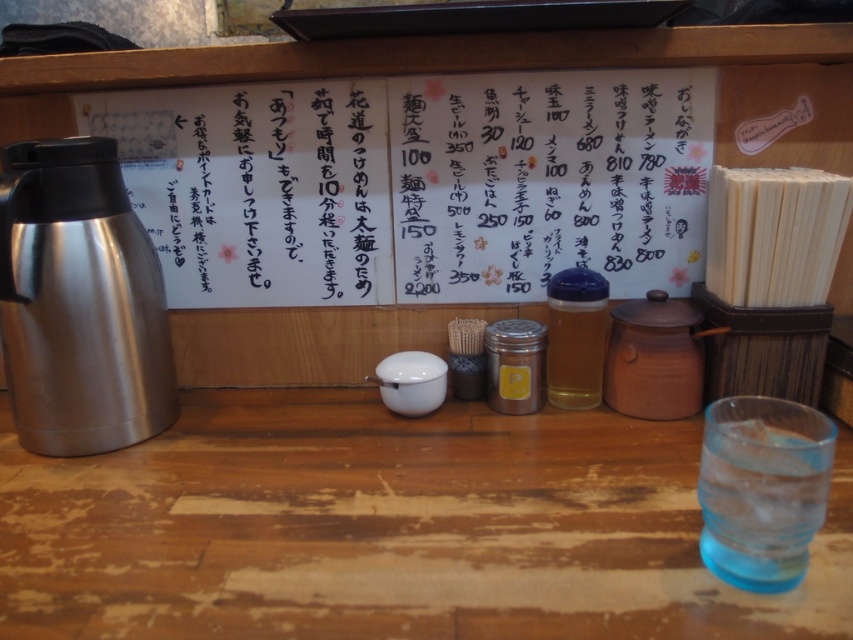
Question: Among these objects, which one is nearest to the camera?

Choices:
 (A) wooden table at center
 (B) white paper at center

Answer: (A)

Question: Does white paper at center have a lesser width compared to shiny metallic thermos at left?

Choices:
 (A) yes
 (B) no

Answer: (B)

Question: Which of the following is the closest to the observer?

Choices:
 (A) shiny metallic thermos at left
 (B) white paper at center

Answer: (A)

Question: Can you confirm if shiny metallic thermos at left is bigger than clear glass water at right?

Choices:
 (A) no
 (B) yes

Answer: (B)

Question: Which object is positioned farthest from the wooden table at center?

Choices:
 (A) translucent glass bottle at center
 (B) shiny metallic thermos at left
 (C) white paper at center

Answer: (C)

Question: Is wooden table at center to the right of translucent glass bottle at center from the viewer's perspective?

Choices:
 (A) no
 (B) yes

Answer: (A)